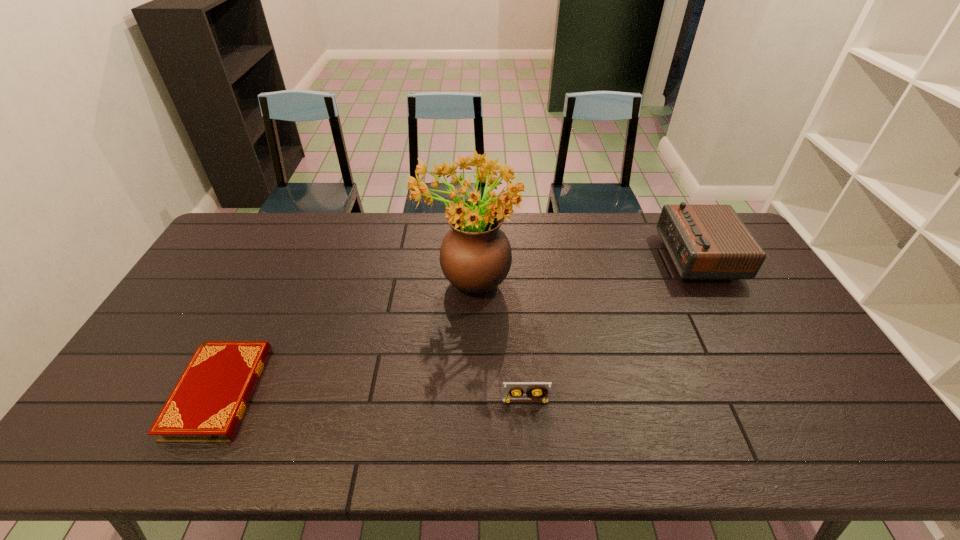
This screenshot has height=540, width=960. I want to click on the third closest object to the tallest object, so click(705, 242).

Select which object is the second closest to the radio receiver. Please provide its 2D coordinates. Your answer should be formatted as a tuple, i.e. [(x, y)], where the tuple contains the x and y coordinates of a point satisfying the conditions above.

[(536, 391)]

Where is `vacant space that satisfies the following two spatial constraints: 1. on the front panel of the radio receiver; 2. on the cover of the leftmost object`? vacant space that satisfies the following two spatial constraints: 1. on the front panel of the radio receiver; 2. on the cover of the leftmost object is located at coordinates (773, 392).

Locate an element on the screen. This screenshot has width=960, height=540. free location that satisfies the following two spatial constraints: 1. on the front panel of the third shortest object; 2. on the front side of the tallest object is located at coordinates (710, 279).